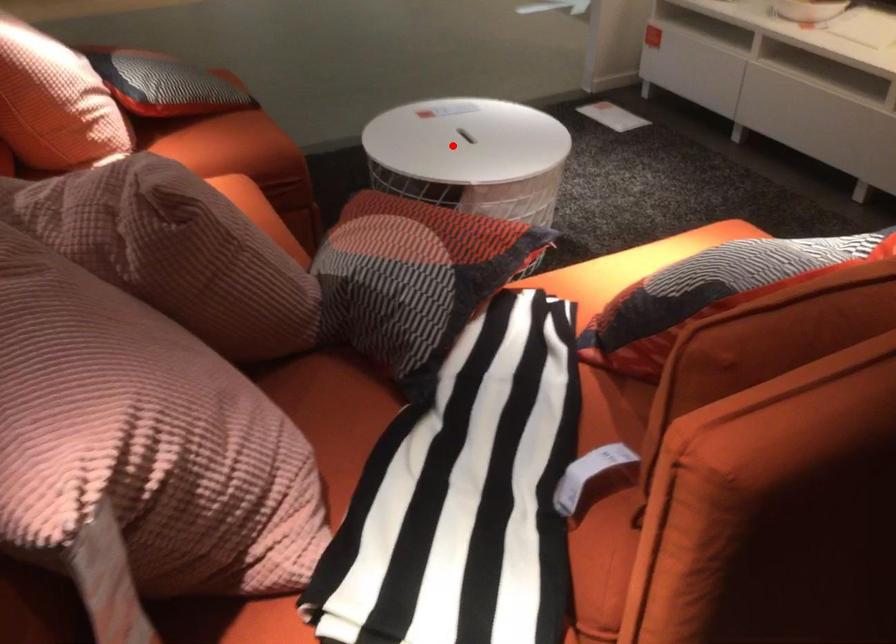
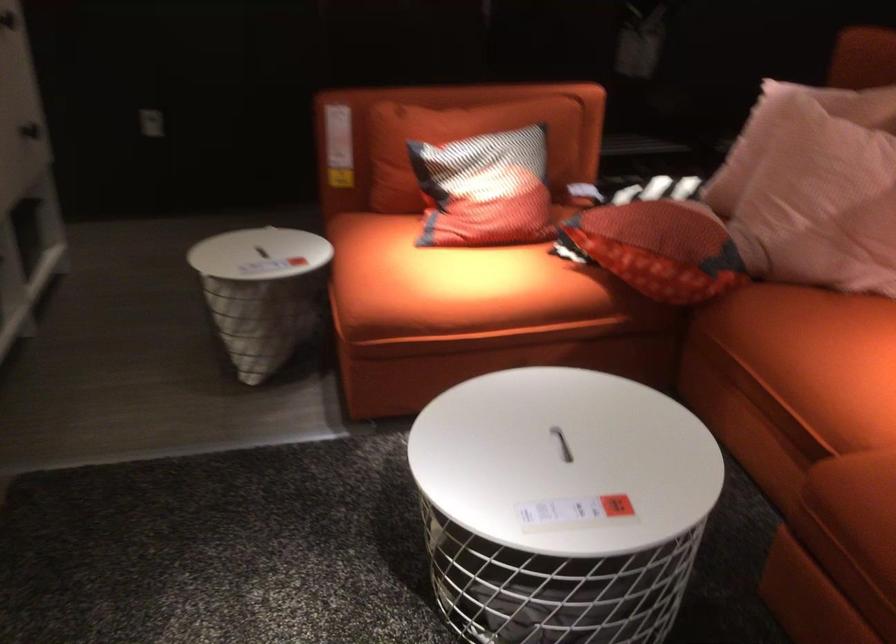
Question: A red point is marked in image1. In image2, is the corresponding 3D point closer to the camera or farther? Reply with the corresponding letter.

Choices:
 (A) The corresponding 3D point is closer.
 (B) The corresponding 3D point is farther.

Answer: (A)